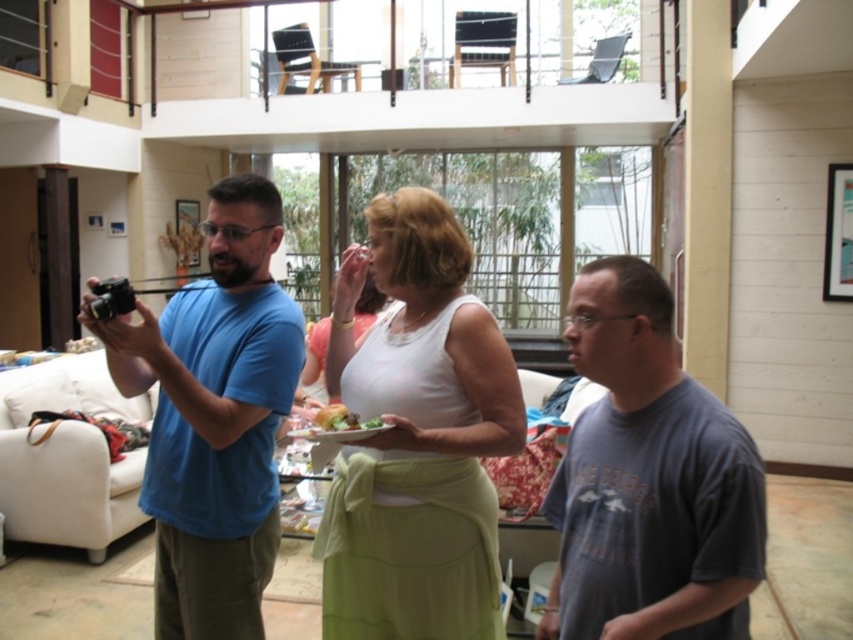
Can you confirm if white matte tank top at center is shorter than blue cotton shirt at left?

Yes, white matte tank top at center is shorter than blue cotton shirt at left.

Does point (480, 307) come in front of point (253, 451)?

That is True.

Between point (444, 627) and point (144, 317), which one is positioned behind?

The point (444, 627) is more distant.

Locate an element on the screen. This screenshot has width=853, height=640. white matte tank top at center is located at coordinates (416, 436).

Consider the image. Is white matte tank top at center below gray cotton t-shirt at center?

Actually, white matte tank top at center is above gray cotton t-shirt at center.

Which is behind, point (490, 577) or point (578, 520)?

The point (490, 577) is more distant.

Where is `white matte tank top at center`? The image size is (853, 640). white matte tank top at center is located at coordinates (416, 436).

Can you confirm if blue cotton shirt at left is thinner than green leafy salad at center?

Incorrect, blue cotton shirt at left's width is not less than green leafy salad at center's.

Can you confirm if blue cotton shirt at left is wider than green leafy salad at center?

Correct, the width of blue cotton shirt at left exceeds that of green leafy salad at center.

Is point (225, 372) less distant than point (370, 426)?

No, (225, 372) is further to viewer.

Find the location of a particular element. The image size is (853, 640). blue cotton shirt at left is located at coordinates (213, 417).